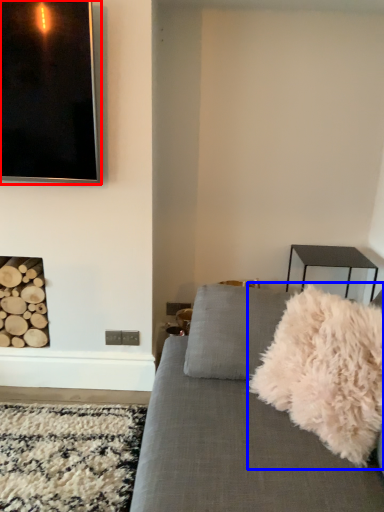
Question: Which of the following is the farthest to the observer, picture frame (highlighted by a red box) or throw pillow (highlighted by a blue box)?

Choices:
 (A) picture frame
 (B) throw pillow

Answer: (A)